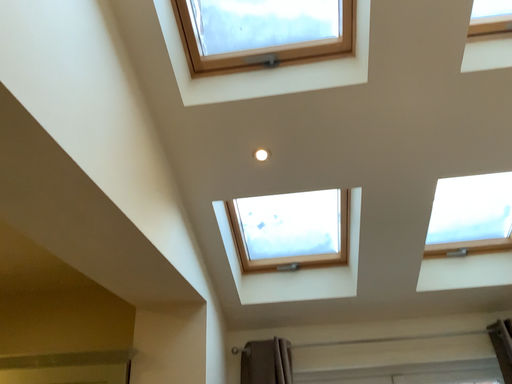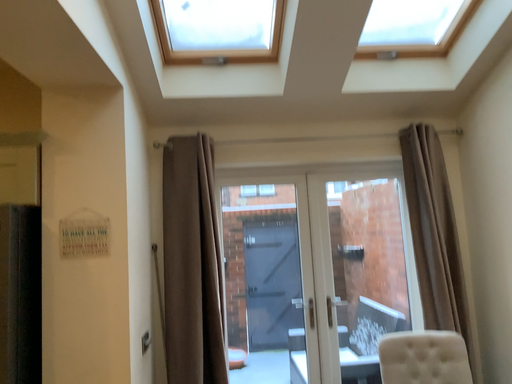
Question: Which way did the camera rotate in the video?

Choices:
 (A) rotated upward
 (B) rotated downward

Answer: (B)